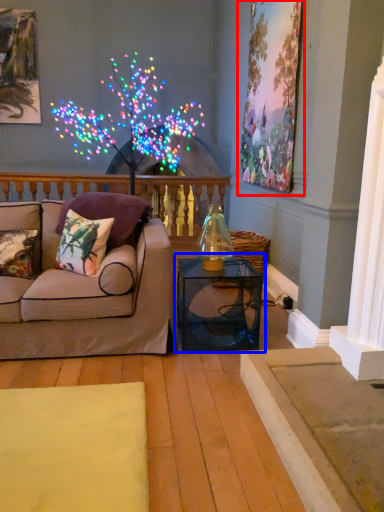
Question: Which object is closer to the camera taking this photo, picture frame (highlighted by a red box) or table (highlighted by a blue box)?

Choices:
 (A) picture frame
 (B) table

Answer: (B)